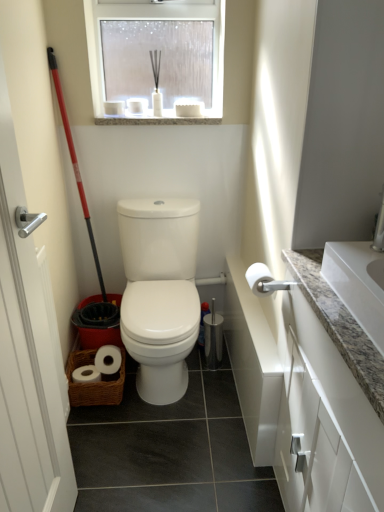
Question: Is white matte toilet paper at right wider or thinner than silver metallic screen door at left?

Choices:
 (A) wide
 (B) thin

Answer: (A)

Question: From a real-world perspective, relative to silver metallic screen door at left, is white matte toilet paper at right vertically above or below?

Choices:
 (A) above
 (B) below

Answer: (B)

Question: Considering the real-world distances, which object is closest to the translucent glass window at upper center?

Choices:
 (A) white glossy toilet at center
 (B) silver metallic screen door at left
 (C) red plastic shovel at left
 (D) white matte toilet paper at right
 (E) granite countertop at right

Answer: (C)

Question: Which of these objects is positioned farthest from the granite countertop at right?

Choices:
 (A) white glossy toilet at center
 (B) red plastic shovel at left
 (C) silver metallic screen door at left
 (D) granite at upper center
 (E) white matte toilet paper at right

Answer: (B)